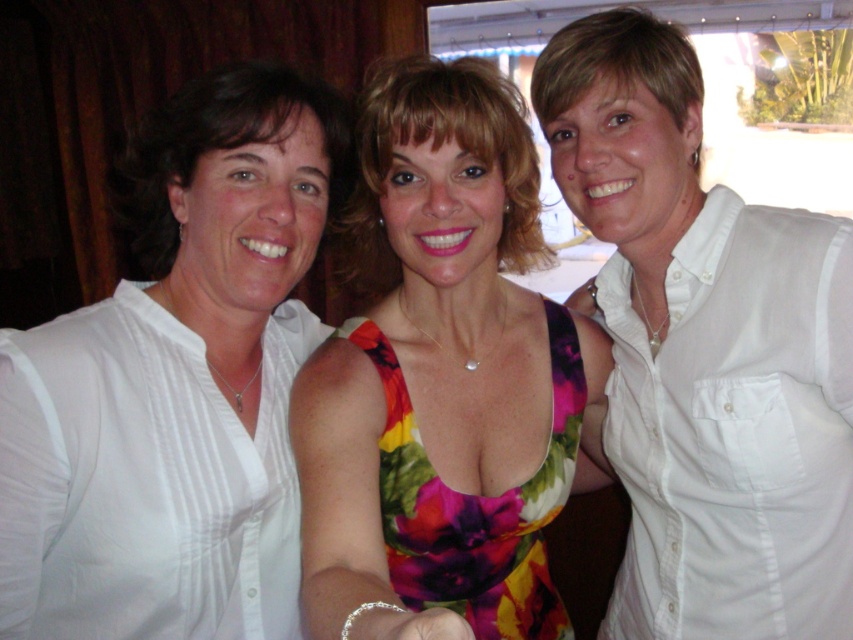
You are a photographer setting up a photo shoot. You have two white tops to place in the scene. The white satin blouse at left and the white cotton shirt at right. Based on their sizes, which one would you choose to place in a smaller space to ensure it fits properly?

The white satin blouse at left occupies less space than the white cotton shirt at right, so it would be the better choice for a smaller space as it requires less room to fit properly.

In the scene, there are two white shirts. The white satin blouse at left and the white cotton shirt at right. Which one is positioned more to the left side?

The white satin blouse at left is positioned more to the left side than the white cotton shirt at right.